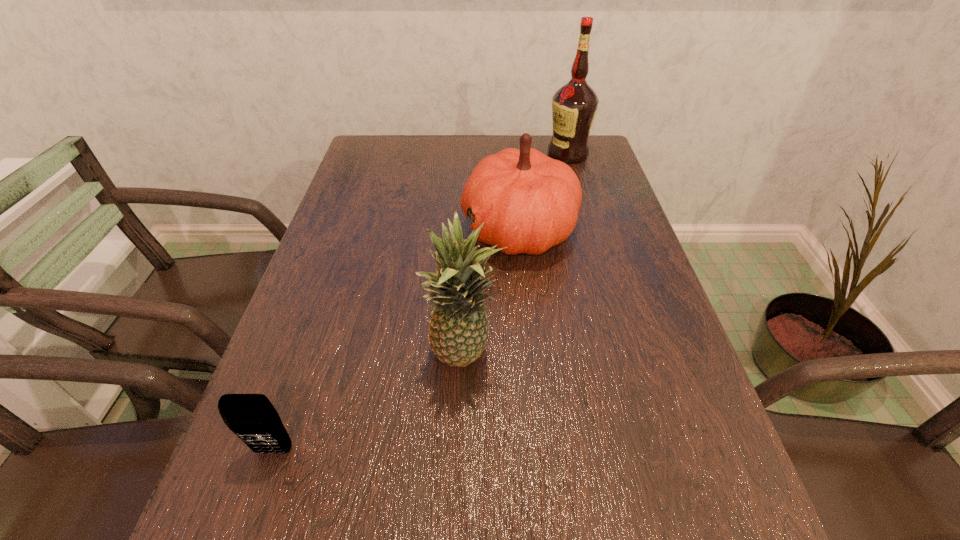
At what (x,y) coordinates should I click in order to perform the action: click on free space between the second tallest object and the pumpkin. Please return your answer as a coordinate pair (x, y). The height and width of the screenshot is (540, 960). Looking at the image, I should click on (492, 293).

Find the location of a particular element. The height and width of the screenshot is (540, 960). free space between the second shortest object and the third farthest object is located at coordinates (492, 293).

The image size is (960, 540). I want to click on vacant area between the tallest object and the pineapple, so click(x=516, y=256).

Find the location of `unoccupied area between the third shortest object and the third tallest object`. unoccupied area between the third shortest object and the third tallest object is located at coordinates [x=492, y=293].

Identify which object is the third closest to the second farthest object. Please provide its 2D coordinates. Your answer should be formatted as a tuple, i.e. [(x, y)], where the tuple contains the x and y coordinates of a point satisfying the conditions above.

[(252, 417)]

Point out which object is positioned as the third nearest to the second farthest object. Please provide its 2D coordinates. Your answer should be formatted as a tuple, i.e. [(x, y)], where the tuple contains the x and y coordinates of a point satisfying the conditions above.

[(252, 417)]

Locate an element on the screen. vacant space that satisfies the following two spatial constraints: 1. on the label of the alcohol; 2. on the screen of the nearest object is located at coordinates 653,451.

What are the coordinates of `vacant space that satisfies the following two spatial constraints: 1. on the label of the tallest object; 2. on the screen of the cellular telephone` in the screenshot? It's located at (653, 451).

In order to click on free spot that satisfies the following two spatial constraints: 1. on the front-facing side of the second shortest object; 2. on the screen of the shortest object in this screenshot , I will do `click(541, 451)`.

This screenshot has width=960, height=540. I want to click on free spot that satisfies the following two spatial constraints: 1. on the front-facing side of the third tallest object; 2. on the front side of the third farthest object, so click(532, 357).